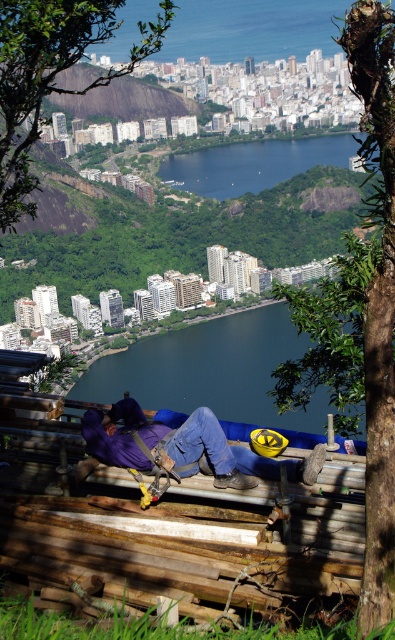
You are a construction worker standing on the wooden structure in the foreground. You notice two bodies of water in the scene. Which one is higher in elevation, the dark blue water at center or the blue glassy water at center?

The dark blue water at center is much taller than the blue glassy water at center, so the dark blue water at center is higher in elevation.

You are a construction worker standing on the wooden structure in the foreground. You need to place a 3m wide equipment box between the purple fabric at center and the blue glassy water at center. Is there enough space between them to fit the equipment box?

The purple fabric at center has a larger width than the blue glassy water at center. However, the description only provides a comparison of their widths, not the exact distance between them. Therefore, it is impossible to determine if the 3m wide equipment box can fit between them based on the given information.